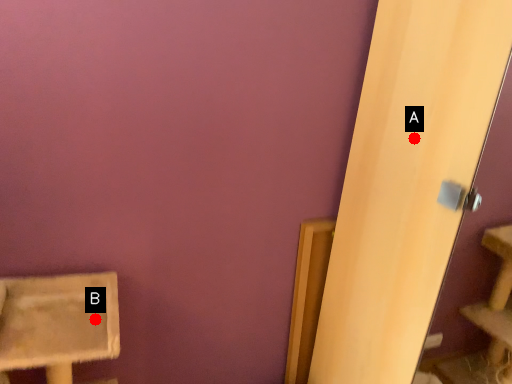
Question: Two points are circled on the image, labeled by A and B beside each circle. Which point is farther from the camera taking this photo?

Choices:
 (A) A is further
 (B) B is further

Answer: (A)